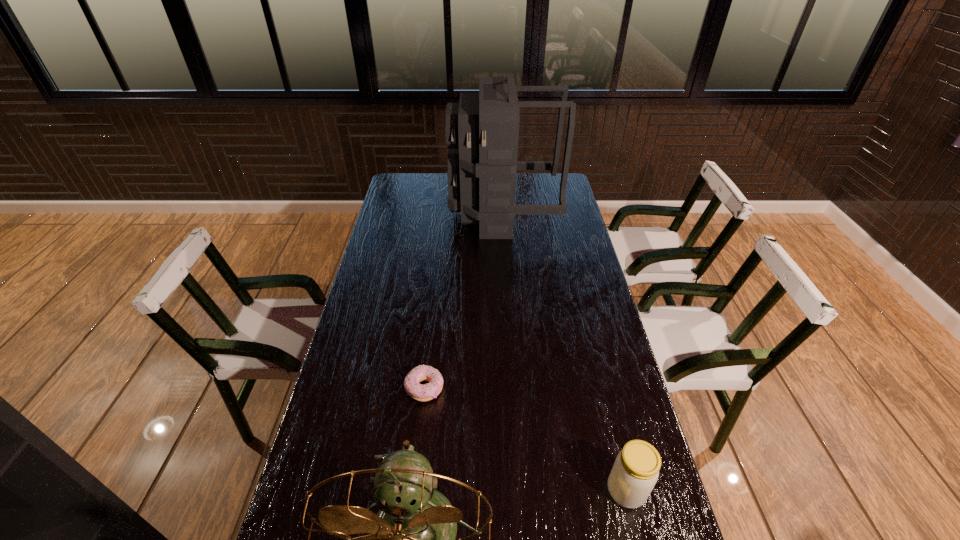
Identify the location of object at the far edge. The height and width of the screenshot is (540, 960). (482, 131).

The width and height of the screenshot is (960, 540). What are the coordinates of `backpack at the right edge` in the screenshot? It's located at (482, 131).

Locate an element on the screen. jar at the right edge is located at coordinates (635, 472).

Where is `object at the far right corner`? Image resolution: width=960 pixels, height=540 pixels. object at the far right corner is located at coordinates (482, 131).

Identify the location of free space at the far edge of the desktop. (531, 195).

Image resolution: width=960 pixels, height=540 pixels. What are the coordinates of `vacant space at the left edge of the desktop` in the screenshot? It's located at (390, 214).

Locate an element on the screen. This screenshot has width=960, height=540. vacant area at the right edge is located at coordinates (571, 242).

Image resolution: width=960 pixels, height=540 pixels. I want to click on free area in between the tallest object and the doughnut, so click(464, 301).

This screenshot has height=540, width=960. Identify the location of vacant area between the third tallest object and the shortest object. (525, 440).

Where is `free area in between the second farthest object and the tallest object`? Image resolution: width=960 pixels, height=540 pixels. free area in between the second farthest object and the tallest object is located at coordinates (464, 301).